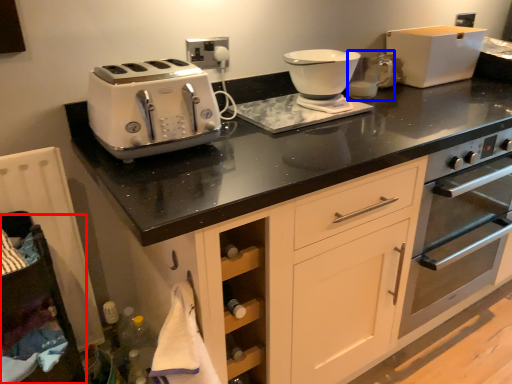
Question: Which object appears farthest to the camera in this image, cabinetry (highlighted by a red box) or coffee machine (highlighted by a blue box)?

Choices:
 (A) cabinetry
 (B) coffee machine

Answer: (B)